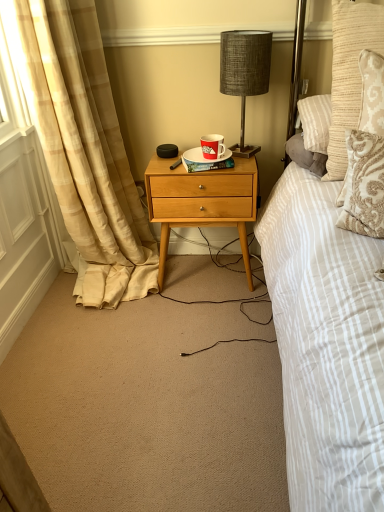
Question: Considering the relative positions of natural wood nightstand at center and red paper cup at center in the image provided, is natural wood nightstand at center to the left or to the right of red paper cup at center?

Choices:
 (A) left
 (B) right

Answer: (A)

Question: Is point (168, 167) positioned closer to the camera than point (208, 156)?

Choices:
 (A) farther
 (B) closer

Answer: (A)

Question: Based on their relative distances, which object is farther from the textured gray lamp at upper center?

Choices:
 (A) beige plaid curtain at left
 (B) hardcover book at center
 (C) red paper cup at center
 (D) white glossy plate at center
 (E) textured beige pillow at upper right

Answer: (A)

Question: Estimate the real-world distances between objects in this image. Which object is farther from the textured gray lamp at upper center?

Choices:
 (A) hardcover book at center
 (B) textured beige pillow at upper right
 (C) red paper cup at center
 (D) white glossy plate at center
 (E) beige plaid curtain at left

Answer: (E)